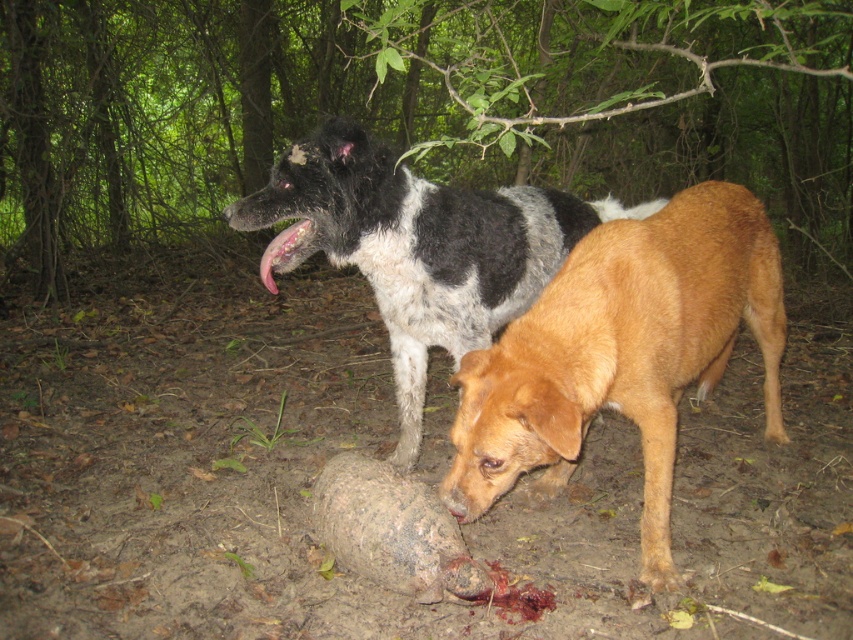
Question: Is brown furry dog at lower center closer to the viewer compared to black and white fur dog at center?

Choices:
 (A) no
 (B) yes

Answer: (B)

Question: Which object is the closest to the pink flesh at center?

Choices:
 (A) green leafy forest at upper center
 (B) brown furry dog at lower center
 (C) black and white fur dog at center

Answer: (C)

Question: Does brown furry dog at lower center have a larger size compared to black and white fur dog at center?

Choices:
 (A) no
 (B) yes

Answer: (A)

Question: Based on their relative distances, which object is nearer to the black and white fur dog at center?

Choices:
 (A) pink flesh at center
 (B) green leafy forest at upper center

Answer: (A)

Question: Can you confirm if green leafy forest at upper center is bigger than brown furry dog at lower center?

Choices:
 (A) no
 (B) yes

Answer: (A)

Question: Which point appears closest to the camera in this image?

Choices:
 (A) (525, 280)
 (B) (262, 257)
 (C) (169, 20)

Answer: (B)